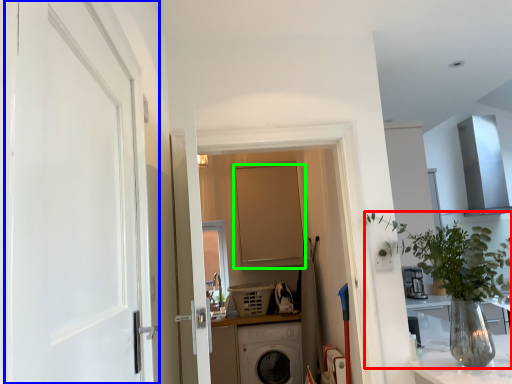
Question: Which is farther away from houseplant (highlighted by a red box)? door (highlighted by a blue box) or door (highlighted by a green box)?

Choices:
 (A) door
 (B) door

Answer: (B)